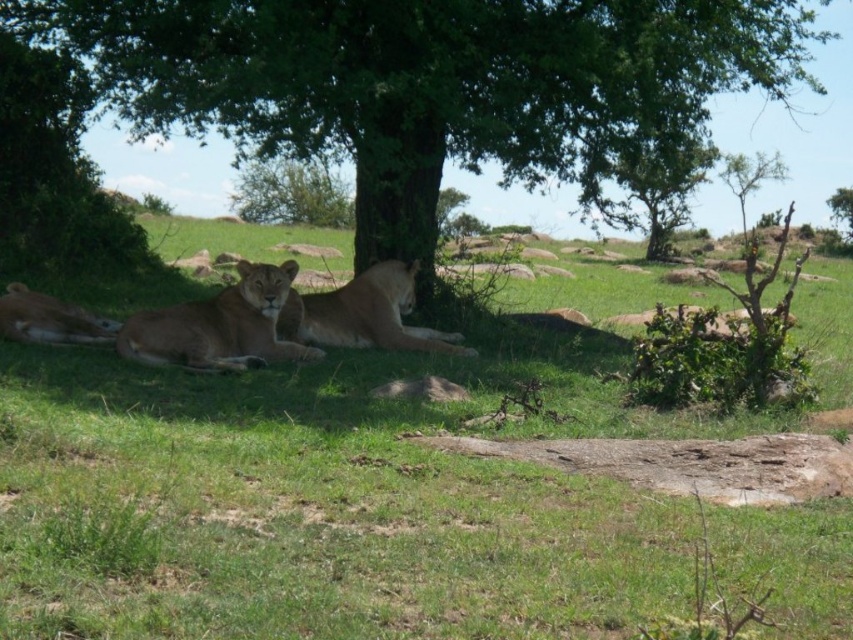
You are standing at the point marked by the coordinates point (439, 86), which is green leafy tree at center. Looking around, you see the lions resting under the shade of the tree. Can you determine which direction the lions are relative to the tree?

The lions are resting under the shade of the green leafy tree at center, so they are positioned below the tree in terms of spatial relation.

You are a photographer trying to capture a photo of the golden fur lion at center. You want to ensure the green leafy tree at center is fully visible in the background. Do you think the tree will fit entirely in the frame if the lion is centered?

The green leafy tree at center might be wider than golden fur lion at center, so there is a possibility that the tree may not fit entirely in the frame if the lion is centered, as its width could exceed the lion.